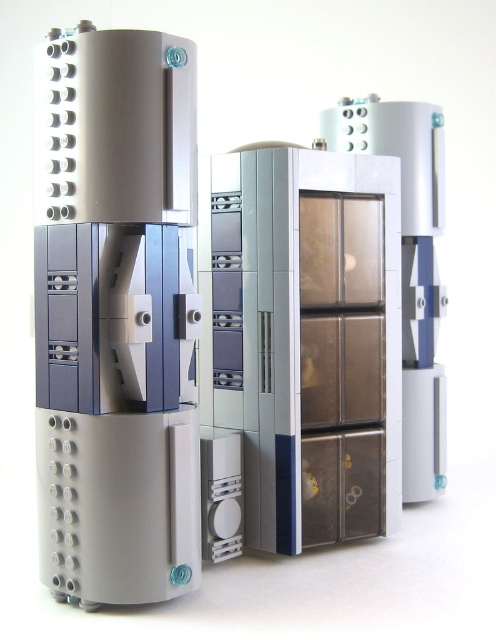
Question: Among these objects, which one is farthest from the camera?

Choices:
 (A) translucent plastic file cabinet at center
 (B) translucent plastic drawer at center
 (C) matte gray tower at left

Answer: (B)

Question: Estimate the real-world distances between objects in this image. Which object is farther from the matte gray tower at left?

Choices:
 (A) translucent plastic file cabinet at center
 (B) translucent plastic drawer at center

Answer: (B)

Question: Estimate the real-world distances between objects in this image. Which object is farther from the translucent plastic file cabinet at center?

Choices:
 (A) translucent plastic drawer at center
 (B) matte gray tower at left

Answer: (A)

Question: Can you confirm if matte gray tower at left is positioned to the left of translucent plastic file cabinet at center?

Choices:
 (A) yes
 (B) no

Answer: (A)

Question: Is matte gray tower at left bigger than translucent plastic drawer at center?

Choices:
 (A) yes
 (B) no

Answer: (B)

Question: Can you confirm if translucent plastic file cabinet at center is wider than translucent plastic drawer at center?

Choices:
 (A) no
 (B) yes

Answer: (B)